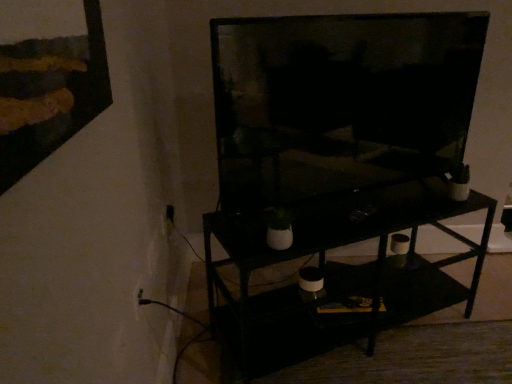
What do you see at coordinates (138, 301) in the screenshot?
I see `white plastic electric outlet at lower left` at bounding box center [138, 301].

Measure the distance between point (428, 172) and camera.

A distance of 5.17 feet exists between point (428, 172) and camera.

The image size is (512, 384). What do you see at coordinates (337, 273) in the screenshot? I see `black matte shelf at center` at bounding box center [337, 273].

In order to click on white plastic electric outlet at lower left in this screenshot , I will do `click(138, 301)`.

Is point (390, 26) less distant than point (135, 292)?

No.

Considering the relative sizes of matte black tv at center and white plastic electric outlet at lower left in the image provided, is matte black tv at center shorter than white plastic electric outlet at lower left?

No.

From a real-world perspective, who is located higher, matte black tv at center or white plastic electric outlet at lower left?

matte black tv at center, from a real-world perspective.

Would you say matte black tv at center is a long distance from black matte shelf at center?

No.

Between matte black tv at center and black matte shelf at center, which one has larger size?

black matte shelf at center.

How many degrees apart are the facing directions of matte black tv at center and black matte shelf at center?

The facing directions of matte black tv at center and black matte shelf at center are 0.00857 degrees apart.

What's the angular difference between black matte shelf at center and white plastic electric outlet at lower left's facing directions?

68.9 degrees.

From the picture: Considering the relative positions of black matte shelf at center and white plastic electric outlet at lower left in the image provided, is black matte shelf at center to the right of white plastic electric outlet at lower left from the viewer's perspective?

Yes, black matte shelf at center is to the right of white plastic electric outlet at lower left.

Identify the location of electric outlet in front of the black matte shelf at center. (138, 301).

Considering the sizes of objects black matte shelf at center and white plastic electric outlet at lower left in the image provided, who is taller, black matte shelf at center or white plastic electric outlet at lower left?

black matte shelf at center.

Considering the relative sizes of white plastic electric outlet at lower left and black matte shelf at center in the image provided, is white plastic electric outlet at lower left wider than black matte shelf at center?

Incorrect, the width of white plastic electric outlet at lower left does not surpass that of black matte shelf at center.

Between white plastic electric outlet at lower left and black matte shelf at center, which one has less height?

Standing shorter between the two is white plastic electric outlet at lower left.

From the picture: Which object is closer to the camera, white plastic electric outlet at lower left or black matte shelf at center?

white plastic electric outlet at lower left is in front.

Is white plastic electric outlet at lower left to the right of black matte shelf at center from the viewer's perspective?

No, white plastic electric outlet at lower left is not to the right of black matte shelf at center.

Considering the relative sizes of black matte shelf at center and matte black tv at center in the image provided, is black matte shelf at center taller than matte black tv at center?

No, black matte shelf at center is not taller than matte black tv at center.

Which is behind, black matte shelf at center or matte black tv at center?

Positioned behind is black matte shelf at center.

From a real-world perspective, is black matte shelf at center physically located above or below matte black tv at center?

From a real-world perspective, black matte shelf at center is physically below matte black tv at center.

Is black matte shelf at center thinner than matte black tv at center?

No.

Does white plastic electric outlet at lower left turn towards matte black tv at center?

No, white plastic electric outlet at lower left is not oriented towards matte black tv at center.

Is white plastic electric outlet at lower left shorter than matte black tv at center?

Yes.

Is there a large distance between white plastic electric outlet at lower left and matte black tv at center?

white plastic electric outlet at lower left is near matte black tv at center, not far away.

Considering their positions, is white plastic electric outlet at lower left located in front of or behind matte black tv at center?

white plastic electric outlet at lower left is behind matte black tv at center.

This screenshot has width=512, height=384. Find the location of `television that appears on the right of white plastic electric outlet at lower left`. television that appears on the right of white plastic electric outlet at lower left is located at coordinates (340, 102).

I want to click on shelf behind the matte black tv at center, so click(x=337, y=273).

When comparing their distances from matte black tv at center, does white plastic electric outlet at lower left or black matte shelf at center seem further?

white plastic electric outlet at lower left.

Considering their positions, is black matte shelf at center positioned further to matte black tv at center than white plastic electric outlet at lower left?

The object further to matte black tv at center is white plastic electric outlet at lower left.

When comparing their distances from white plastic electric outlet at lower left, does black matte shelf at center or matte black tv at center seem further?

matte black tv at center is positioned further to the anchor white plastic electric outlet at lower left.

Estimate the real-world distances between objects in this image. Which object is closer to black matte shelf at center, matte black tv at center or white plastic electric outlet at lower left?

Among the two, matte black tv at center is located nearer to black matte shelf at center.

Looking at the image, which one is located further to black matte shelf at center, white plastic electric outlet at lower left or matte black tv at center?

white plastic electric outlet at lower left.

Which object lies nearer to the anchor point white plastic electric outlet at lower left, matte black tv at center or black matte shelf at center?

The object closer to white plastic electric outlet at lower left is black matte shelf at center.

Where is `television situated between white plastic electric outlet at lower left and black matte shelf at center from left to right`? This screenshot has width=512, height=384. television situated between white plastic electric outlet at lower left and black matte shelf at center from left to right is located at coordinates (340, 102).